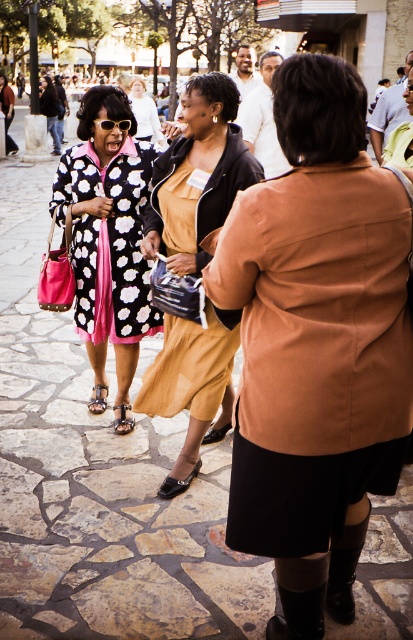
Question: Is matte black dress at center below polka dot coat at center?

Choices:
 (A) yes
 (B) no

Answer: (A)

Question: Does brown matte jacket at center have a lesser width compared to matte black dress at center?

Choices:
 (A) yes
 (B) no

Answer: (A)

Question: Which point is closer to the camera?

Choices:
 (A) (246, 275)
 (B) (142, 273)

Answer: (A)

Question: Can you confirm if matte black dress at center is positioned below polka dot coat at center?

Choices:
 (A) yes
 (B) no

Answer: (A)

Question: Which object is the farthest from the floral-patterned coat at left?

Choices:
 (A) brown matte jacket at center
 (B) matte black dress at center

Answer: (A)

Question: Which object appears farthest from the camera in this image?

Choices:
 (A) matte black dress at center
 (B) polka dot coat at center
 (C) floral-patterned coat at left
 (D) brown matte jacket at center

Answer: (B)